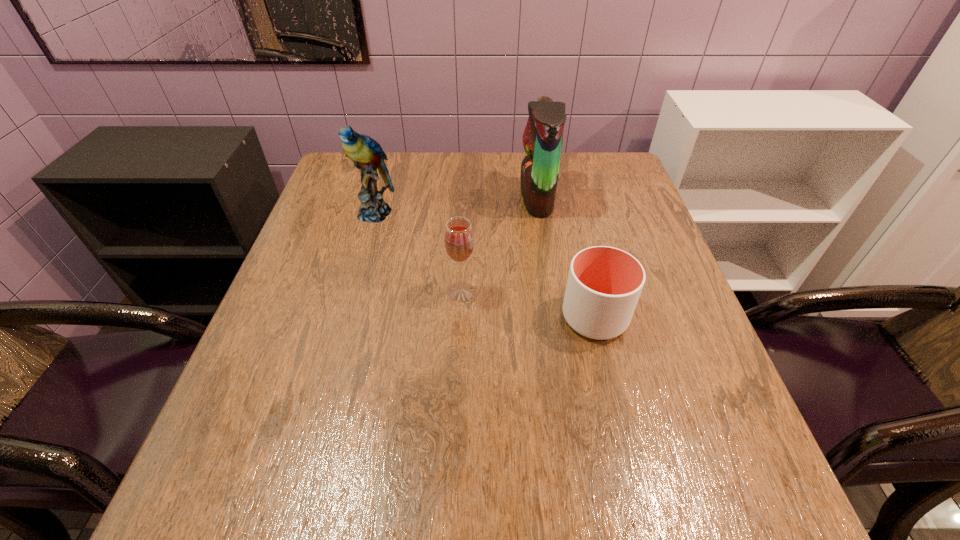
What are the coordinates of `object that stands as the closest to the wineglass` in the screenshot? It's located at (604, 284).

Locate an element on the screen. the closest object to the third tallest object is located at coordinates (604, 284).

At what (x,y) coordinates should I click in order to perform the action: click on vacant space that satisfies the following two spatial constraints: 1. at the face of the right parrot; 2. on the face of the left parrot. Please return your answer as a coordinate pair (x, y). Looking at the image, I should click on (539, 213).

Identify the location of vacant region that satisfies the following two spatial constraints: 1. on the face of the wineglass; 2. on the left side of the leftmost object. (353, 292).

At what (x,y) coordinates should I click in order to perform the action: click on free point that satisfies the following two spatial constraints: 1. at the face of the cup; 2. on the right side of the right parrot. Please return your answer as a coordinate pair (x, y). The height and width of the screenshot is (540, 960). Looking at the image, I should click on (555, 317).

The height and width of the screenshot is (540, 960). I want to click on vacant position in the image that satisfies the following two spatial constraints: 1. on the back side of the cup; 2. at the face of the right parrot, so click(566, 198).

This screenshot has width=960, height=540. Find the location of `free space in the image that satisfies the following two spatial constraints: 1. at the face of the cup; 2. on the left side of the right parrot`. free space in the image that satisfies the following two spatial constraints: 1. at the face of the cup; 2. on the left side of the right parrot is located at coordinates (555, 317).

Where is `vacant space that satisfies the following two spatial constraints: 1. at the face of the right parrot; 2. on the front side of the second object from left to right`? The width and height of the screenshot is (960, 540). vacant space that satisfies the following two spatial constraints: 1. at the face of the right parrot; 2. on the front side of the second object from left to right is located at coordinates (551, 292).

Find the location of a particular element. The height and width of the screenshot is (540, 960). free space that satisfies the following two spatial constraints: 1. at the face of the right parrot; 2. on the face of the left parrot is located at coordinates (539, 213).

This screenshot has width=960, height=540. What are the coordinates of `vacant point that satisfies the following two spatial constraints: 1. at the face of the right parrot; 2. on the face of the left parrot` in the screenshot? It's located at (539, 213).